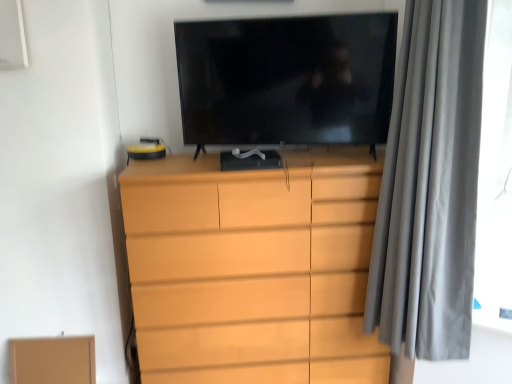
Question: Considering the relative positions of black glossy tv at center and gray velvet curtain at right in the image provided, is black glossy tv at center to the left or to the right of gray velvet curtain at right?

Choices:
 (A) right
 (B) left

Answer: (B)

Question: Does point (230, 142) appear closer or farther from the camera than point (396, 316)?

Choices:
 (A) farther
 (B) closer

Answer: (A)

Question: Which object is the closest to the matte wood chest of drawers at center?

Choices:
 (A) black glossy tv at center
 (B) brown cardboard box at lower left
 (C) gray velvet curtain at right

Answer: (C)

Question: Which is farther from the black glossy tv at center?

Choices:
 (A) brown cardboard box at lower left
 (B) gray velvet curtain at right
 (C) matte wood chest of drawers at center

Answer: (A)